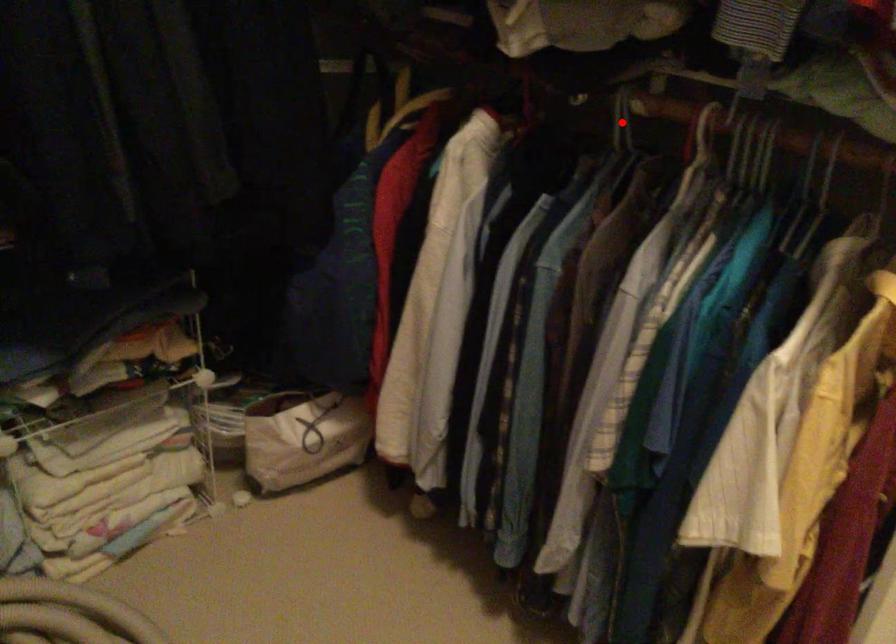
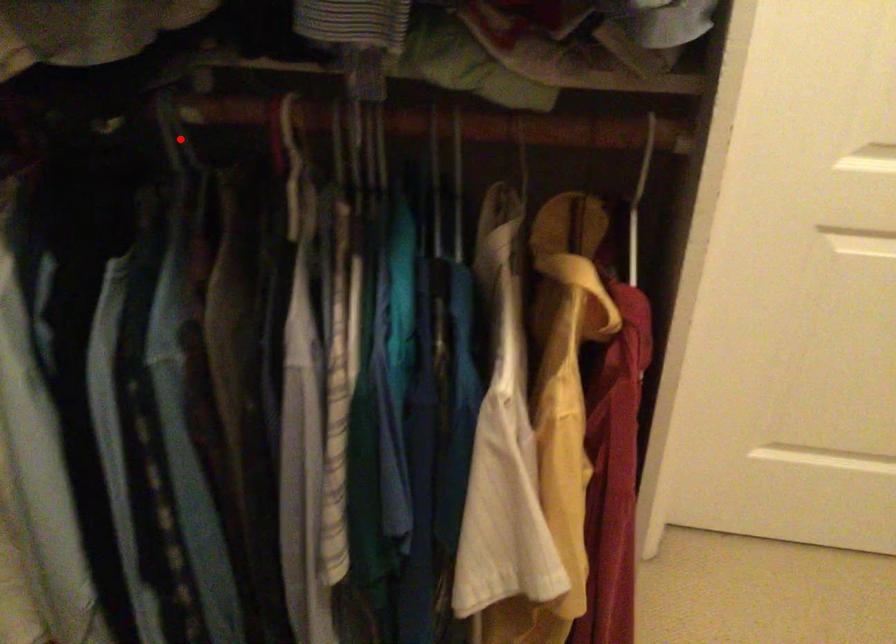
I am providing you with two images of the same scene from different viewpoints. A red point is marked on the first image and another point is marked on the second image. Is the marked point in image1 the same physical position as the marked point in image2?

Yes